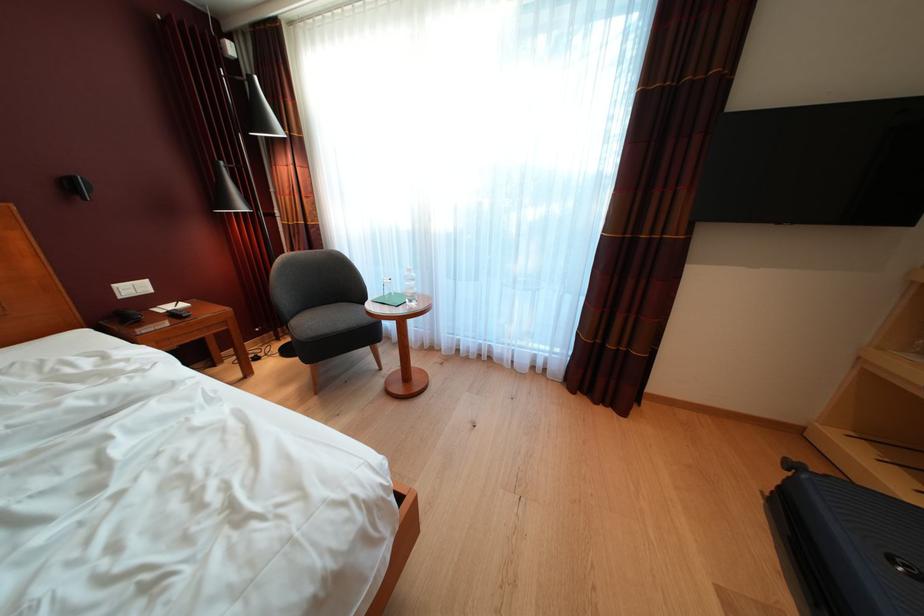
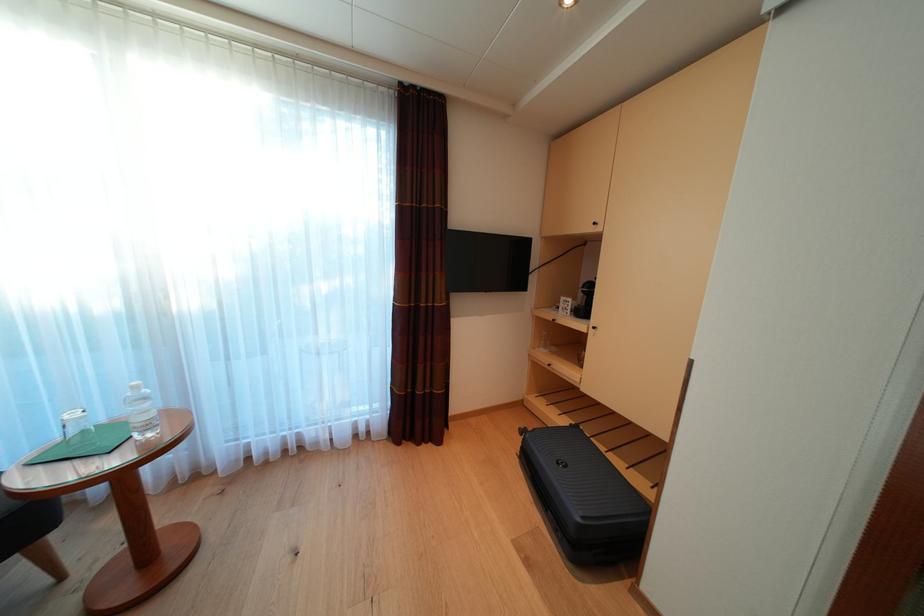
Locate, in the second image, the point that corresponds to (x=418, y=276) in the first image.

(144, 392)